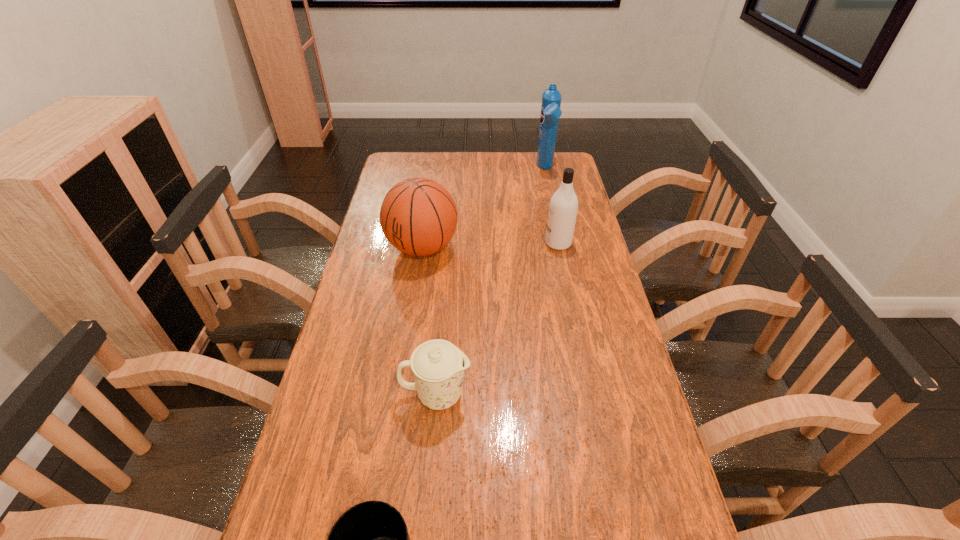
Where is `object identified as the closest to the nearer shampoo`? object identified as the closest to the nearer shampoo is located at coordinates tap(418, 216).

Locate an element on the screen. object identified as the closest to the fourth farthest object is located at coordinates (370, 539).